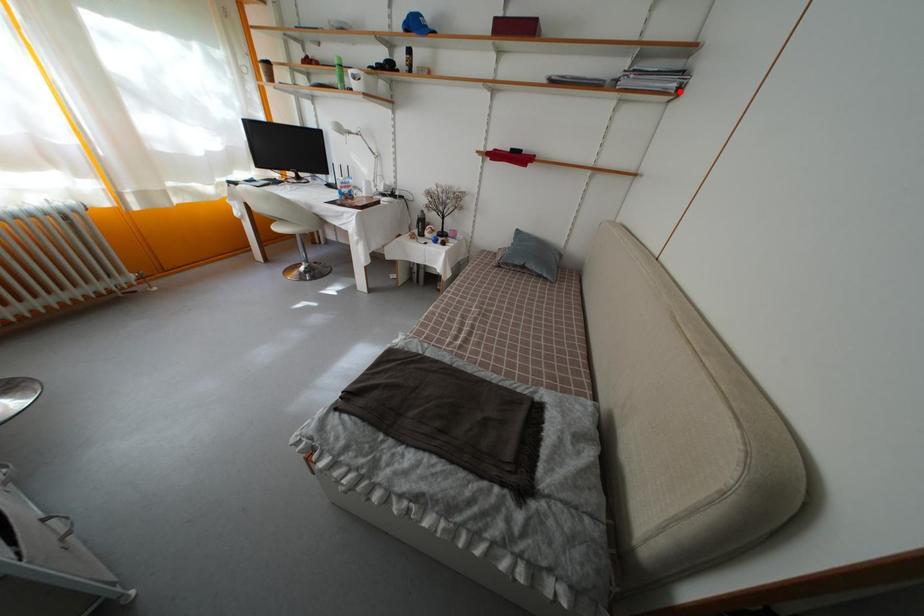
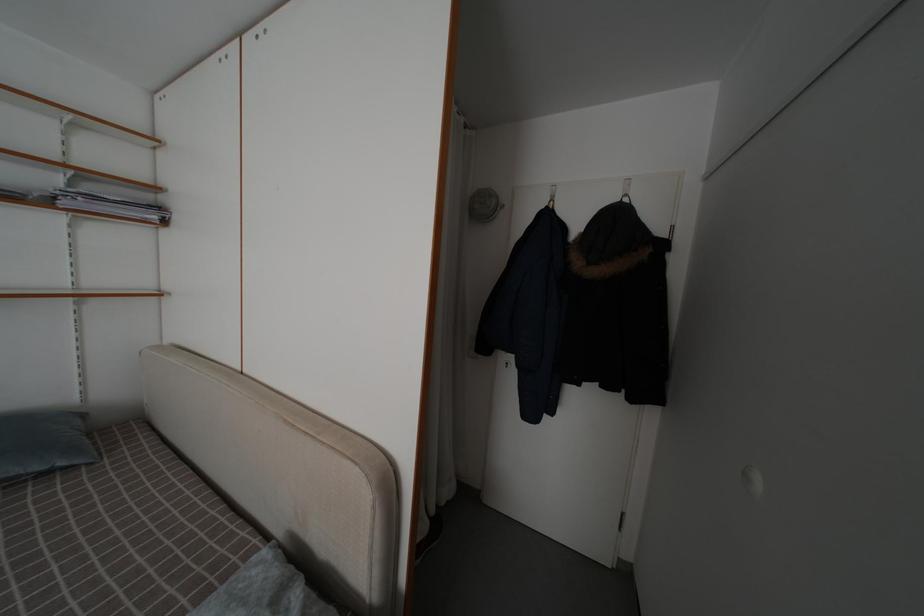
Find the pixel in the second image that matches the highlighted location in the first image.

(161, 224)